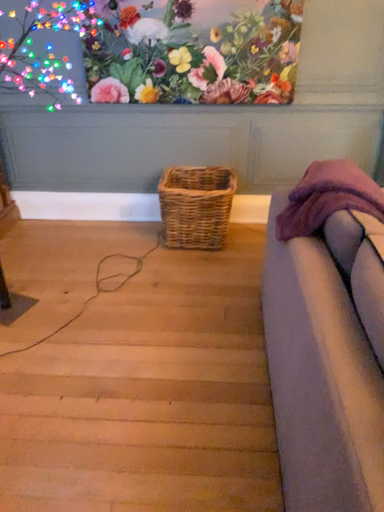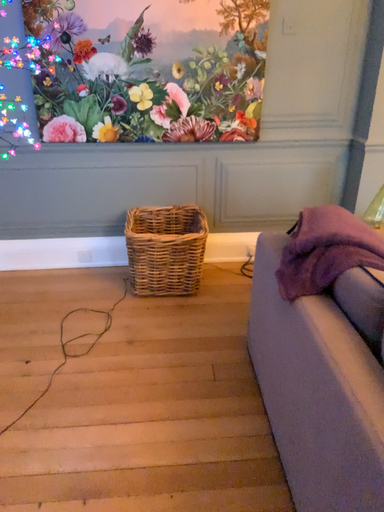
Question: How did the camera likely rotate when shooting the video?

Choices:
 (A) rotated right
 (B) rotated left

Answer: (A)